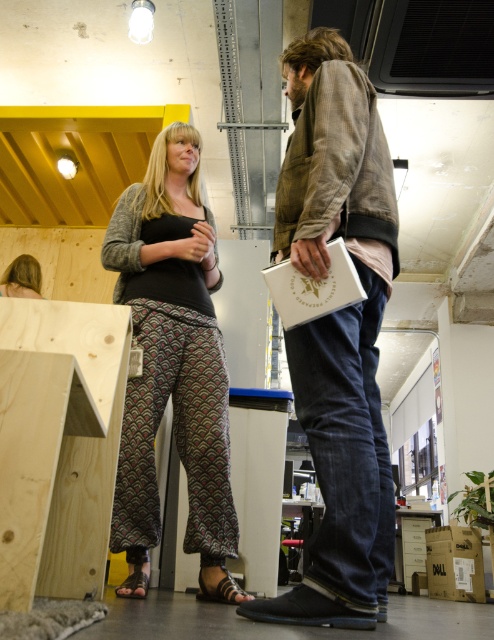
Question: Which object is closer to the camera taking this photo?

Choices:
 (A) denim jacket at center
 (B) patterned fabric pants at center

Answer: (A)

Question: Does denim jacket at center have a larger size compared to blonde hair at lower left?

Choices:
 (A) yes
 (B) no

Answer: (A)

Question: Which of the following is the closest to the observer?

Choices:
 (A) (27, 268)
 (B) (364, 141)
 (C) (203, 387)

Answer: (B)

Question: Can you confirm if denim jacket at center is thinner than patterned fabric pants at center?

Choices:
 (A) no
 (B) yes

Answer: (B)

Question: Which point is farther to the camera?

Choices:
 (A) (304, 115)
 (B) (193, 260)
 (C) (2, 280)

Answer: (C)

Question: Does denim jacket at center appear on the right side of patterned fabric pants at center?

Choices:
 (A) no
 (B) yes

Answer: (B)